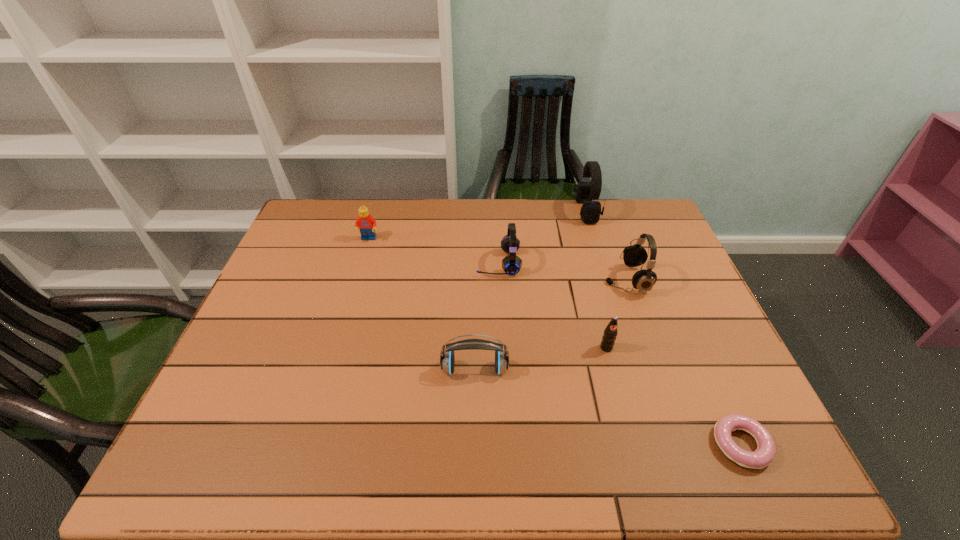
This screenshot has height=540, width=960. What are the coordinates of `doughnut positioned at the right edge` in the screenshot? It's located at (764, 455).

Identify the location of object at the near right corner. [764, 455].

You are a GUI agent. You are given a task and a screenshot of the screen. Output one action in this format:
    pyautogui.click(x=<x>, y=<y>)
    Task: Click on the vacant space at the far edge of the desktop
    The image size is (960, 540).
    Given the screenshot: What is the action you would take?
    pyautogui.click(x=517, y=221)

Locate an element on the screen. The image size is (960, 540). vacant space at the near edge of the desktop is located at coordinates (621, 444).

In the image, there is a desktop. Identify the location of free space at the left edge. This screenshot has width=960, height=540. (215, 402).

In the image, there is a desktop. Identify the location of vacant space at the right edge. This screenshot has width=960, height=540. (688, 388).

Image resolution: width=960 pixels, height=540 pixels. Find the location of `vacant space at the far left corner`. vacant space at the far left corner is located at coordinates (329, 201).

Identify the location of free space at the far right corner of the desktop. The image size is (960, 540). (631, 227).

In the image, there is a desktop. At what (x,y) coordinates should I click in order to perform the action: click on free space at the near right corner. Please return your answer as a coordinate pair (x, y). The image size is (960, 540). Looking at the image, I should click on (779, 471).

I want to click on vacant area between the second farthest object and the shortest object, so click(x=555, y=342).